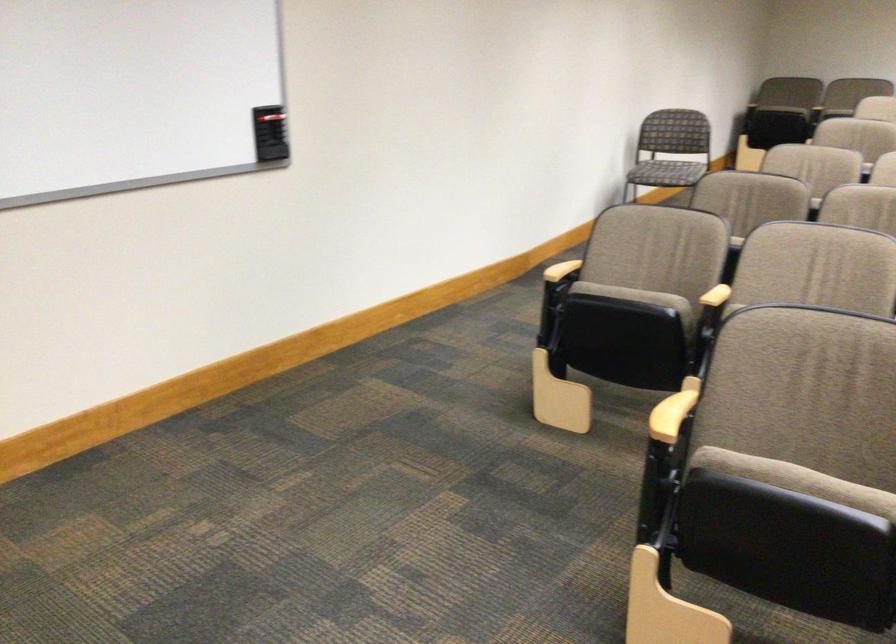
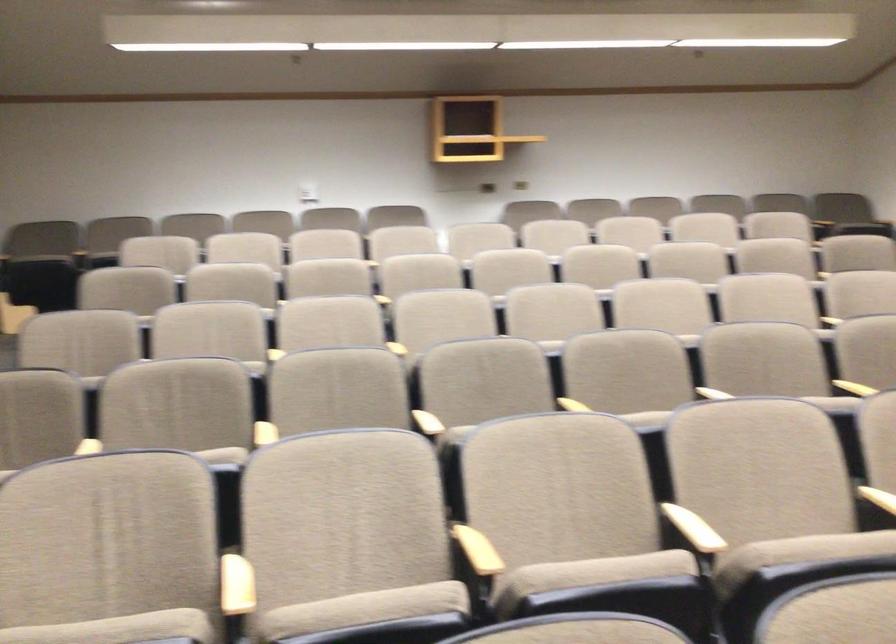
Question: How did the camera likely rotate?

Choices:
 (A) Left
 (B) Right
 (C) Up
 (D) Down

Answer: (B)